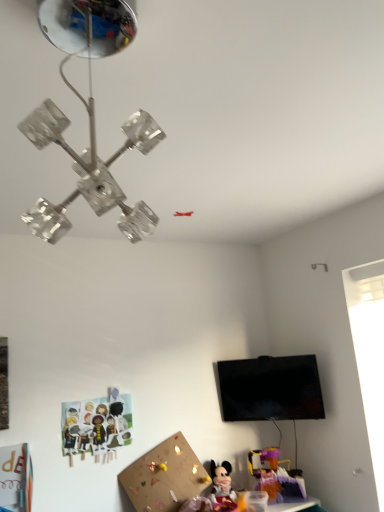
Find the location of a particular element. The width and height of the screenshot is (384, 512). black glossy tv at upper right is located at coordinates (269, 389).

Describe the element at coordinates (292, 504) in the screenshot. The width and height of the screenshot is (384, 512). I see `translucent plastic table at lower right` at that location.

This screenshot has width=384, height=512. Describe the element at coordinates (97, 426) in the screenshot. I see `paper cutout characters at lower left, which is counted as the 1th toy, starting from the left` at that location.

How much space does matte plastic minnie mouse at lower center, which is the second toy from right to left, occupy horizontally?

The width of matte plastic minnie mouse at lower center, which is the second toy from right to left, is 5.46 inches.

What do you see at coordinates (275, 475) in the screenshot?
I see `plastic purple toy at lower right, the third toy when ordered from left to right` at bounding box center [275, 475].

Locate an element on the screen. The image size is (384, 512). black glossy tv at upper right is located at coordinates (269, 389).

Would you say paper cutout characters at lower left, which ranks as the third toy in right-to-left order, contains plastic purple toy at lower right, the 1th toy positioned from the right?

No, plastic purple toy at lower right, the 1th toy positioned from the right, is located outside of paper cutout characters at lower left, which ranks as the third toy in right-to-left order.

What's the angular difference between paper cutout characters at lower left, which ranks as the third toy in right-to-left order, and plastic purple toy at lower right, the 1th toy positioned from the right,'s facing directions?

30.4 degrees separate the facing orientations of paper cutout characters at lower left, which ranks as the third toy in right-to-left order, and plastic purple toy at lower right, the 1th toy positioned from the right.

How much distance is there between paper cutout characters at lower left, which is counted as the 1th toy, starting from the left, and plastic purple toy at lower right, the third toy when ordered from left to right?

paper cutout characters at lower left, which is counted as the 1th toy, starting from the left, and plastic purple toy at lower right, the third toy when ordered from left to right, are 36.12 inches apart.

The width and height of the screenshot is (384, 512). I want to click on toy that appears above the plastic purple toy at lower right, the 1th toy positioned from the right (from a real-world perspective), so click(x=97, y=426).

Based on the photo, do you think plastic purple toy at lower right, the third toy when ordered from left to right, is within black glossy tv at upper right, or outside of it?

plastic purple toy at lower right, the third toy when ordered from left to right, cannot be found inside black glossy tv at upper right.

Does point (273, 475) come closer to viewer compared to point (220, 378)?

Yes, it is in front of point (220, 378).

Considering the sizes of objects clear glass chandelier at upper center and plastic purple toy at lower right, the 1th toy positioned from the right, in the image provided, who is bigger, clear glass chandelier at upper center or plastic purple toy at lower right, the 1th toy positioned from the right,?

clear glass chandelier at upper center.

In the scene shown: Is clear glass chandelier at upper center wider or thinner than plastic purple toy at lower right, the third toy when ordered from left to right?

clear glass chandelier at upper center is wider than plastic purple toy at lower right, the third toy when ordered from left to right.

Which is behind, point (54, 24) or point (255, 458)?

The point (255, 458) is more distant.

Is matte plastic minnie mouse at lower center, the second toy positioned from the left, taller than clear glass chandelier at upper center?

In fact, matte plastic minnie mouse at lower center, the second toy positioned from the left, may be shorter than clear glass chandelier at upper center.

From the image's perspective, would you say matte plastic minnie mouse at lower center, the second toy positioned from the left, is shown under clear glass chandelier at upper center?

Yes.

Can you confirm if matte plastic minnie mouse at lower center, the second toy positioned from the left, is positioned to the left of clear glass chandelier at upper center?

In fact, matte plastic minnie mouse at lower center, the second toy positioned from the left, is to the right of clear glass chandelier at upper center.

Is matte plastic minnie mouse at lower center, the second toy positioned from the left, closer to the viewer compared to clear glass chandelier at upper center?

No, the depth of matte plastic minnie mouse at lower center, the second toy positioned from the left, is greater than that of clear glass chandelier at upper center.

Who is shorter, matte plastic minnie mouse at lower center, which is the second toy from right to left, or black glossy tv at upper right?

matte plastic minnie mouse at lower center, which is the second toy from right to left.

Considering the relative sizes of matte plastic minnie mouse at lower center, the second toy positioned from the left, and black glossy tv at upper right in the image provided, is matte plastic minnie mouse at lower center, the second toy positioned from the left, smaller than black glossy tv at upper right?

Yes, matte plastic minnie mouse at lower center, the second toy positioned from the left, is smaller than black glossy tv at upper right.

Is matte plastic minnie mouse at lower center, which is the second toy from right to left, positioned with its back to black glossy tv at upper right?

No, matte plastic minnie mouse at lower center, which is the second toy from right to left, is not facing the opposite direction of black glossy tv at upper right.

Which is more to the left, matte plastic minnie mouse at lower center, which is the second toy from right to left, or black glossy tv at upper right?

matte plastic minnie mouse at lower center, which is the second toy from right to left.

From a real-world perspective, which is physically above, clear glass chandelier at upper center or paper cutout characters at lower left, which ranks as the third toy in right-to-left order?

clear glass chandelier at upper center, from a real-world perspective.

How far apart are clear glass chandelier at upper center and paper cutout characters at lower left, which ranks as the third toy in right-to-left order?

clear glass chandelier at upper center and paper cutout characters at lower left, which ranks as the third toy in right-to-left order, are 1.52 meters apart from each other.

Consider the image. Is clear glass chandelier at upper center aimed at paper cutout characters at lower left, which ranks as the third toy in right-to-left order?

No, clear glass chandelier at upper center is not turned towards paper cutout characters at lower left, which ranks as the third toy in right-to-left order.

Where is `the 1st toy positioned below the clear glass chandelier at upper center (from a real-world perspective)`? The height and width of the screenshot is (512, 384). the 1st toy positioned below the clear glass chandelier at upper center (from a real-world perspective) is located at coordinates (97, 426).

Considering the points (308, 504) and (91, 104), which point is behind, point (308, 504) or point (91, 104)?

The point (308, 504) is more distant.

Is translucent plastic table at lower right next to clear glass chandelier at upper center?

translucent plastic table at lower right is not next to clear glass chandelier at upper center, and they're not touching.

Who is smaller, translucent plastic table at lower right or clear glass chandelier at upper center?

translucent plastic table at lower right.

Between translucent plastic table at lower right and clear glass chandelier at upper center, which one has smaller width?

clear glass chandelier at upper center is thinner.

In order to click on the 1st toy below the paper cutout characters at lower left, which ranks as the third toy in right-to-left order (from the image's perspective) in this screenshot , I will do `click(275, 475)`.

The width and height of the screenshot is (384, 512). What are the coordinates of `television above the plastic purple toy at lower right, the third toy when ordered from left to right (from a real-world perspective)` in the screenshot? It's located at (269, 389).

Considering their positions, is matte plastic minnie mouse at lower center, the second toy positioned from the left, positioned further to black glossy tv at upper right than clear glass chandelier at upper center?

clear glass chandelier at upper center lies further to black glossy tv at upper right than the other object.

Which object lies further to the anchor point clear glass chandelier at upper center, plastic purple toy at lower right, the third toy when ordered from left to right, or translucent plastic table at lower right?

→ translucent plastic table at lower right.

Looking at the image, which one is located closer to clear glass chandelier at upper center, plastic purple toy at lower right, the third toy when ordered from left to right, or matte plastic minnie mouse at lower center, the second toy positioned from the left?

Based on the image, matte plastic minnie mouse at lower center, the second toy positioned from the left, appears to be nearer to clear glass chandelier at upper center.

Considering their positions, is translucent plastic table at lower right positioned further to plastic purple toy at lower right, the 1th toy positioned from the right, than black glossy tv at upper right?

The object further to plastic purple toy at lower right, the 1th toy positioned from the right, is black glossy tv at upper right.

Considering their positions, is clear glass chandelier at upper center positioned further to translucent plastic table at lower right than black glossy tv at upper right?

The object further to translucent plastic table at lower right is clear glass chandelier at upper center.

Based on their spatial positions, is black glossy tv at upper right or plastic purple toy at lower right, the third toy when ordered from left to right, further from translucent plastic table at lower right?

Based on the image, black glossy tv at upper right appears to be further to translucent plastic table at lower right.

When comparing their distances from translucent plastic table at lower right, does black glossy tv at upper right or paper cutout characters at lower left, which is counted as the 1th toy, starting from the left, seem further?

The object further to translucent plastic table at lower right is paper cutout characters at lower left, which is counted as the 1th toy, starting from the left.

When comparing their distances from paper cutout characters at lower left, which is counted as the 1th toy, starting from the left, does translucent plastic table at lower right or matte plastic minnie mouse at lower center, which is the second toy from right to left, seem further?

translucent plastic table at lower right.

Where is `toy located between clear glass chandelier at upper center and paper cutout characters at lower left, which is counted as the 1th toy, starting from the left, in the depth direction`? Image resolution: width=384 pixels, height=512 pixels. toy located between clear glass chandelier at upper center and paper cutout characters at lower left, which is counted as the 1th toy, starting from the left, in the depth direction is located at coordinates (222, 488).

Where is `toy situated between paper cutout characters at lower left, which is counted as the 1th toy, starting from the left, and black glossy tv at upper right from left to right`? toy situated between paper cutout characters at lower left, which is counted as the 1th toy, starting from the left, and black glossy tv at upper right from left to right is located at coordinates (222, 488).

Where is `table positioned between clear glass chandelier at upper center and plastic purple toy at lower right, the third toy when ordered from left to right, from near to far`? table positioned between clear glass chandelier at upper center and plastic purple toy at lower right, the third toy when ordered from left to right, from near to far is located at coordinates (292, 504).

Locate an element on the screen. television between paper cutout characters at lower left, which is counted as the 1th toy, starting from the left, and plastic purple toy at lower right, the third toy when ordered from left to right, from left to right is located at coordinates (269, 389).